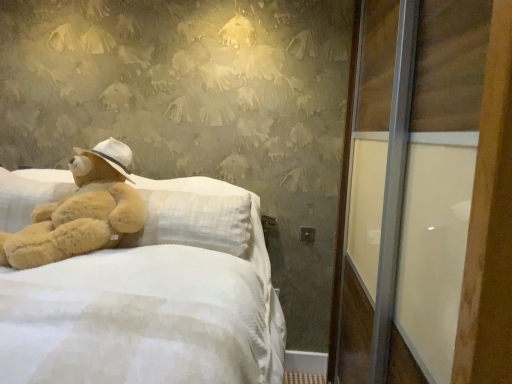
Describe the element at coordinates (147, 313) in the screenshot. I see `soft plush bed at left` at that location.

Image resolution: width=512 pixels, height=384 pixels. What do you see at coordinates (81, 212) in the screenshot?
I see `soft beige plush at left` at bounding box center [81, 212].

Find the location of `soft plush bed at left`. soft plush bed at left is located at coordinates (147, 313).

This screenshot has width=512, height=384. I want to click on screen door that appears on the right of soft beige plush at left, so click(451, 192).

Is transparent glass screen door at right inside or outside of soft beige plush at left?

transparent glass screen door at right exists outside the volume of soft beige plush at left.

Which object is more forward, transparent glass screen door at right or soft beige plush at left?

transparent glass screen door at right is more forward.

From a real-world perspective, does transparent glass screen door at right sit lower than soft beige plush at left?

Yes, from a real-world perspective, transparent glass screen door at right is under soft beige plush at left.

Can you tell me how much soft plush bed at left and transparent glass screen door at right differ in facing direction?

87.5 degrees.

Does soft plush bed at left turn towards transparent glass screen door at right?

No, soft plush bed at left does not turn towards transparent glass screen door at right.

Image resolution: width=512 pixels, height=384 pixels. Identify the location of screen door above the soft plush bed at left (from a real-world perspective). (451, 192).

From the picture: Is transparent glass screen door at right located within soft plush bed at left?

No, transparent glass screen door at right is not inside soft plush bed at left.

Considering the positions of objects soft beige plush at left and transparent glass screen door at right in the image provided, who is behind, soft beige plush at left or transparent glass screen door at right?

soft beige plush at left is further from the camera.

Is soft beige plush at left taller than transparent glass screen door at right?

No.

From a real-world perspective, is soft beige plush at left over transparent glass screen door at right?

Yes, from a real-world perspective, soft beige plush at left is over transparent glass screen door at right

From the image's perspective, does soft beige plush at left appear lower than transparent glass screen door at right?

No, from the image's perspective, soft beige plush at left is not below transparent glass screen door at right.

Measure the distance from soft beige plush at left to soft plush bed at left.

They are 12.45 inches apart.

From a real-world perspective, is soft beige plush at left above or below soft plush bed at left?

soft beige plush at left is above soft plush bed at left.

Is soft beige plush at left not inside soft plush bed at left?

No, soft beige plush at left is inside soft plush bed at left's boundary.

Does soft beige plush at left come in front of soft plush bed at left?

No, soft beige plush at left is further to the viewer.

The image size is (512, 384). I want to click on bed directly beneath the soft beige plush at left (from a real-world perspective), so (147, 313).

Considering the relative sizes of soft plush bed at left and soft beige plush at left in the image provided, is soft plush bed at left thinner than soft beige plush at left?

No, soft plush bed at left is not thinner than soft beige plush at left.

From the image's perspective, which object appears higher, soft plush bed at left or soft beige plush at left?

soft beige plush at left.

Considering the sizes of objects transparent glass screen door at right and soft plush bed at left in the image provided, who is shorter, transparent glass screen door at right or soft plush bed at left?

soft plush bed at left.

Looking at this image, is transparent glass screen door at right positioned beyond the bounds of soft plush bed at left?

Absolutely, transparent glass screen door at right is external to soft plush bed at left.

Measure the distance from transparent glass screen door at right to soft plush bed at left.

They are 26.90 inches apart.

Based on the photo, in the image, is transparent glass screen door at right positioned in front of or behind soft plush bed at left?

In the image, transparent glass screen door at right appears behind soft plush bed at left.

I want to click on teddy bear above the transparent glass screen door at right (from the image's perspective), so click(x=81, y=212).

Find the location of a particular element. Image resolution: width=512 pixels, height=384 pixels. bed that appears in front of the transparent glass screen door at right is located at coordinates (147, 313).

Considering their positions, is transparent glass screen door at right positioned further to soft plush bed at left than soft beige plush at left?

Based on the image, transparent glass screen door at right appears to be further to soft plush bed at left.

Looking at the image, which one is located further to transparent glass screen door at right, soft plush bed at left or soft beige plush at left?

The object further to transparent glass screen door at right is soft beige plush at left.

When comparing their distances from soft beige plush at left, does transparent glass screen door at right or soft plush bed at left seem further?

The object further to soft beige plush at left is transparent glass screen door at right.

Considering their positions, is soft beige plush at left positioned closer to soft plush bed at left than transparent glass screen door at right?

The object closer to soft plush bed at left is soft beige plush at left.

When comparing their distances from transparent glass screen door at right, does soft beige plush at left or soft plush bed at left seem further?

soft beige plush at left is positioned further to the anchor transparent glass screen door at right.

Looking at this image, estimate the real-world distances between objects in this image. Which object is closer to soft beige plush at left, soft plush bed at left or transparent glass screen door at right?

Based on the image, soft plush bed at left appears to be nearer to soft beige plush at left.

You are a GUI agent. You are given a task and a screenshot of the screen. Output one action in this format:
    pyautogui.click(x=<x>, y=<y>)
    Task: Click on the bed between soft beige plush at left and transparent glass screen door at right from left to right
    This screenshot has width=512, height=384.
    Given the screenshot: What is the action you would take?
    147,313